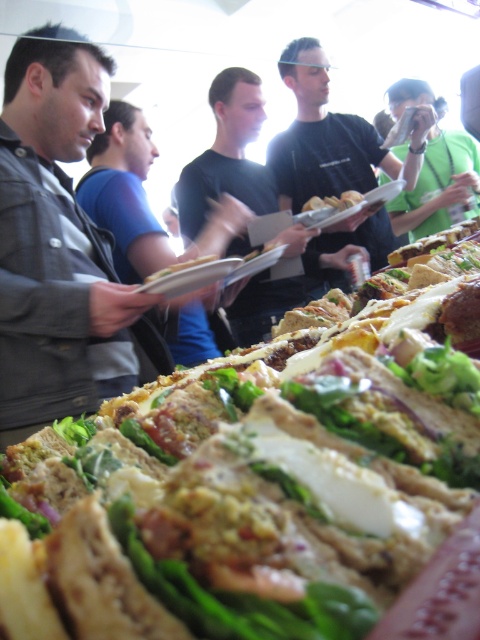
Is green fabric shirt at upper right behind white bread at center?

Yes, it is.

Which is more to the right, green fabric shirt at upper right or white bread at center?

Positioned to the right is green fabric shirt at upper right.

Which is in front, point (442, 164) or point (335, 202)?

Positioned in front is point (335, 202).

I want to click on green fabric shirt at upper right, so click(440, 186).

Who is higher up, blue fabric shirt at left or green fabric shirt at upper right?

green fabric shirt at upper right is higher up.

This screenshot has width=480, height=640. Describe the element at coordinates (142, 198) in the screenshot. I see `blue fabric shirt at left` at that location.

In order to click on blue fabric shirt at left in this screenshot , I will do `click(142, 198)`.

Is black matte shirt at center to the left of blue fabric shirt at left from the viewer's perspective?

In fact, black matte shirt at center is to the right of blue fabric shirt at left.

Is point (381, 241) positioned in front of point (103, 140)?

No, it is behind (103, 140).

Locate an element on the screen. This screenshot has width=480, height=640. black matte shirt at center is located at coordinates (321, 136).